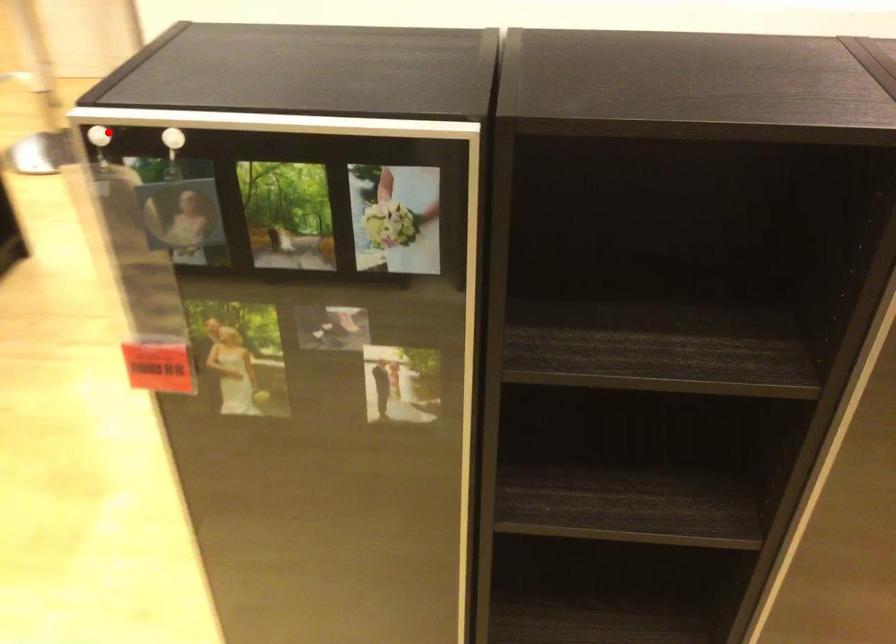
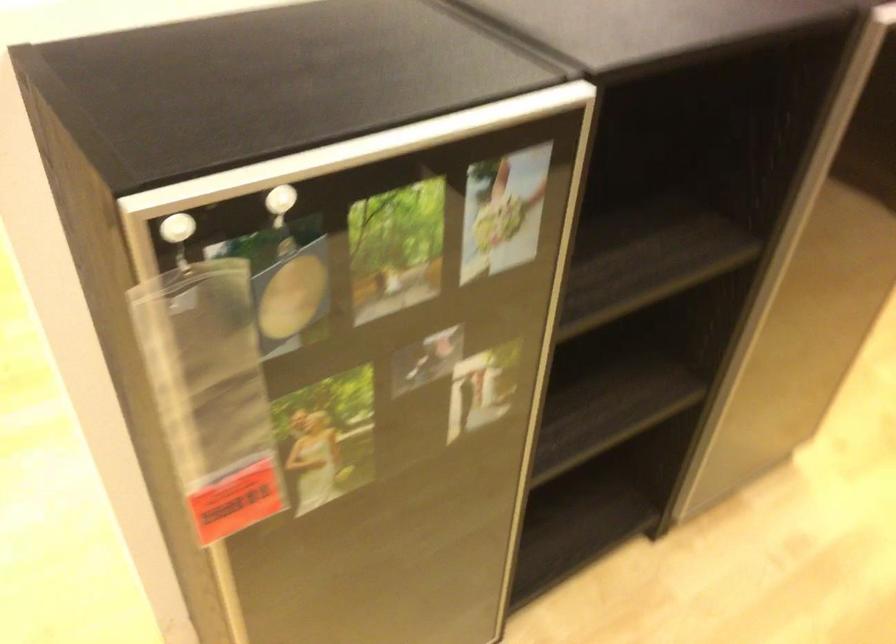
Locate, in the second image, the point that corresponds to the highlighted location in the first image.

(177, 228)